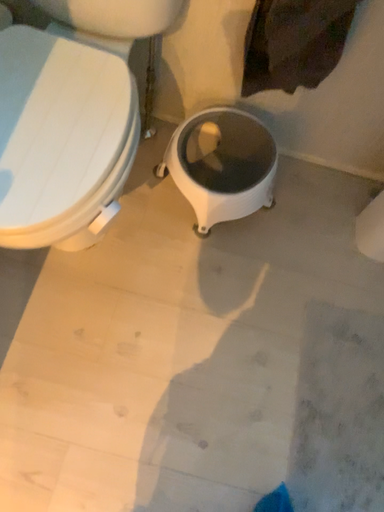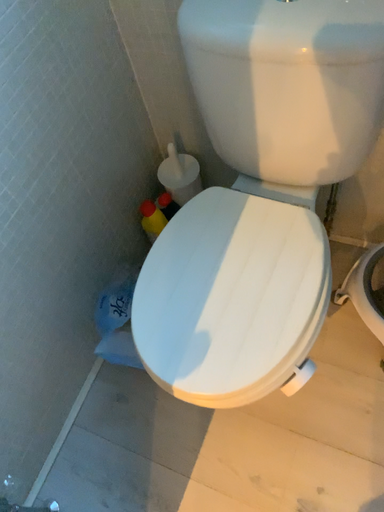
Question: How did the camera likely rotate when shooting the video?

Choices:
 (A) rotated right
 (B) rotated left

Answer: (B)